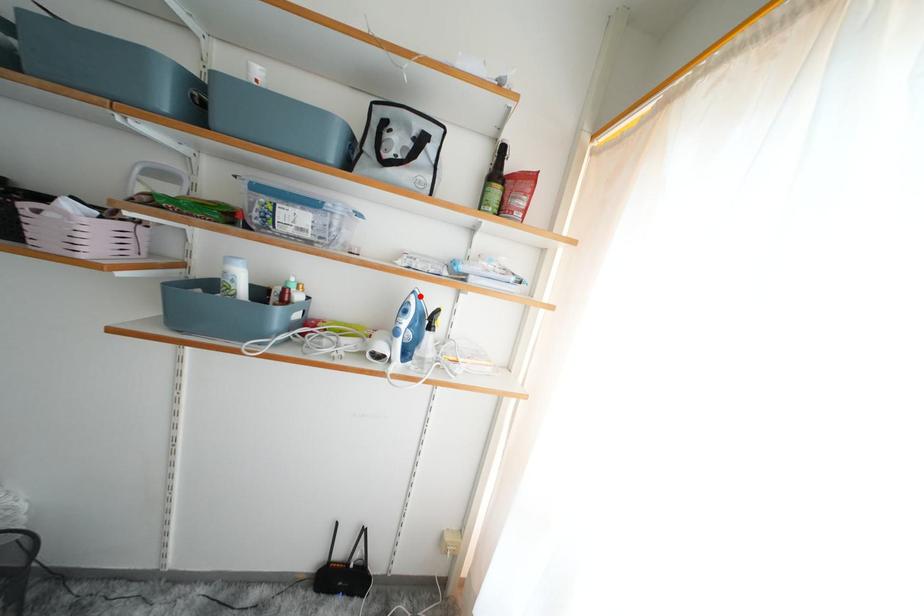
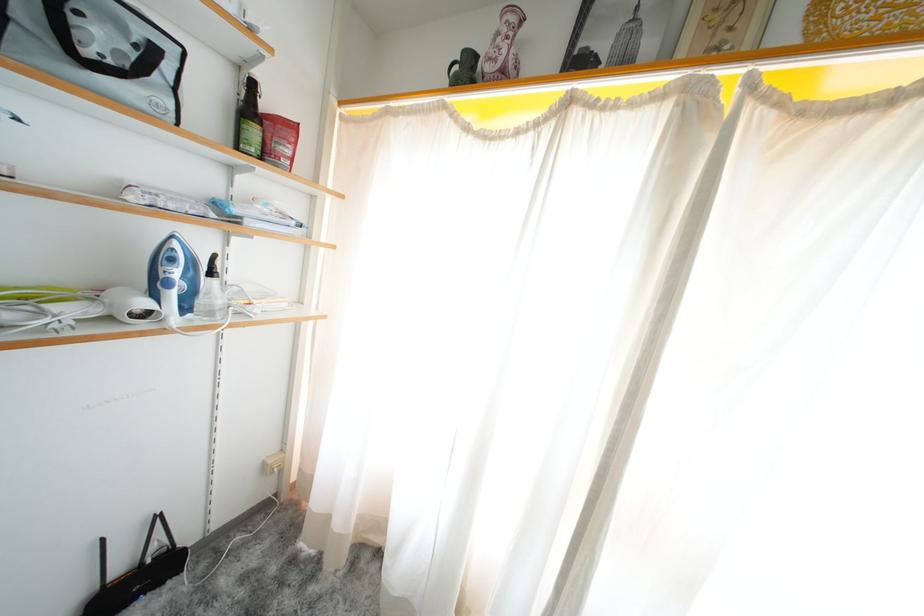
Locate, in the second image, the point that corresponds to the highlighted location in the first image.

(178, 241)